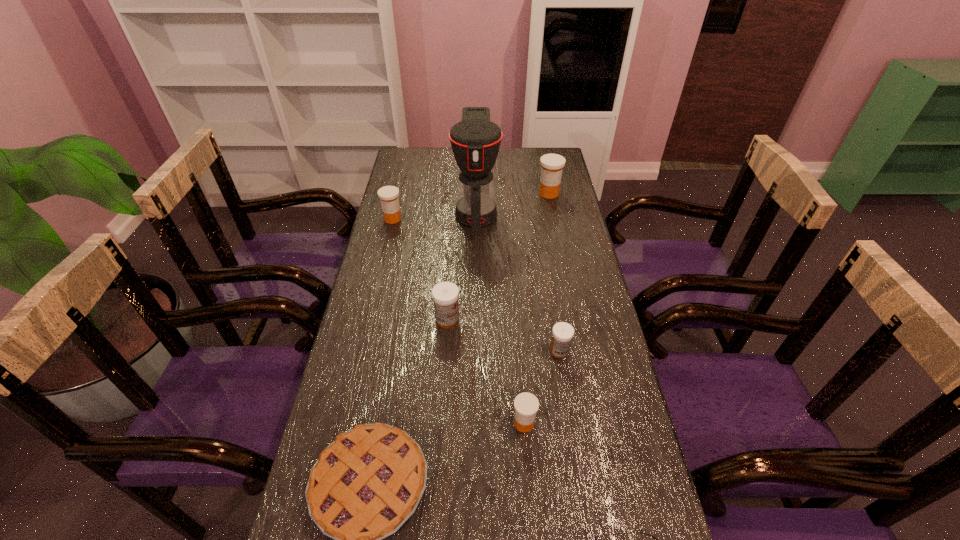
This screenshot has width=960, height=540. I want to click on the second orange medicine from left to right, so click(526, 405).

Where is `vacant space located 0.350m pour from the carafe of the coffee maker`? vacant space located 0.350m pour from the carafe of the coffee maker is located at coordinates (475, 318).

Locate an element on the screen. The width and height of the screenshot is (960, 540). vacant space situated 0.100m on the label of the second tallest object is located at coordinates (553, 215).

The width and height of the screenshot is (960, 540). Find the location of `free space located 0.060m on the right of the fourth farthest object`. free space located 0.060m on the right of the fourth farthest object is located at coordinates (481, 320).

This screenshot has height=540, width=960. I want to click on vacant region located on the label of the second biggest orange medicine, so click(x=373, y=301).

The height and width of the screenshot is (540, 960). I want to click on vacant space located 0.090m on the right of the second nearest medicine, so click(602, 351).

Locate an element on the screen. The image size is (960, 540). free space located on the label of the nearest orange medicine is located at coordinates tap(449, 423).

Image resolution: width=960 pixels, height=540 pixels. In order to click on free location located on the label of the nearest orange medicine in this screenshot , I will do `click(462, 423)`.

Locate an element on the screen. Image resolution: width=960 pixels, height=540 pixels. free space located 0.240m on the label of the nearest orange medicine is located at coordinates pyautogui.click(x=412, y=423).

The image size is (960, 540). I want to click on object that is at the left edge, so click(x=388, y=195).